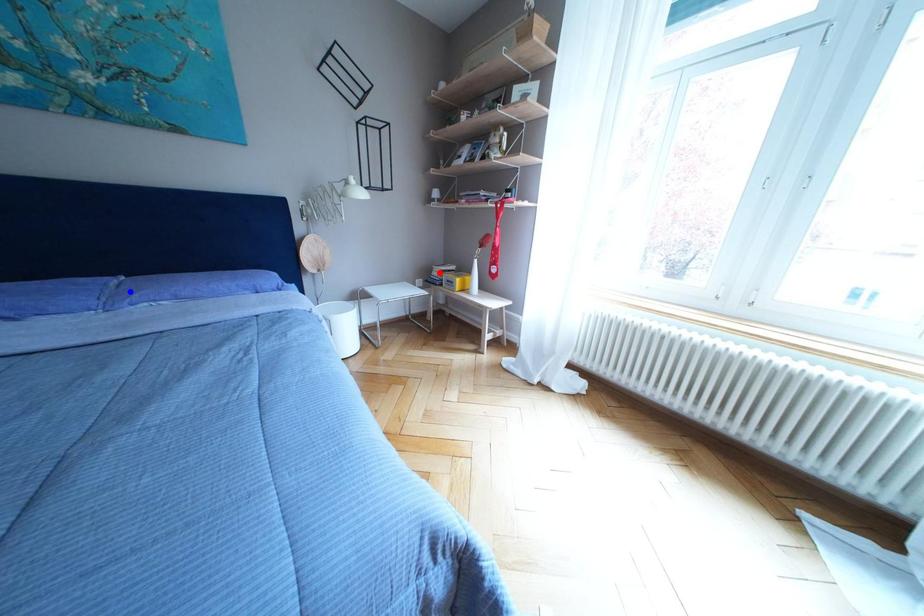
Question: In the image, two points are highlighted. Which point is nearer to the camera? Reply with the corresponding letter.

Choices:
 (A) blue point
 (B) red point

Answer: (A)